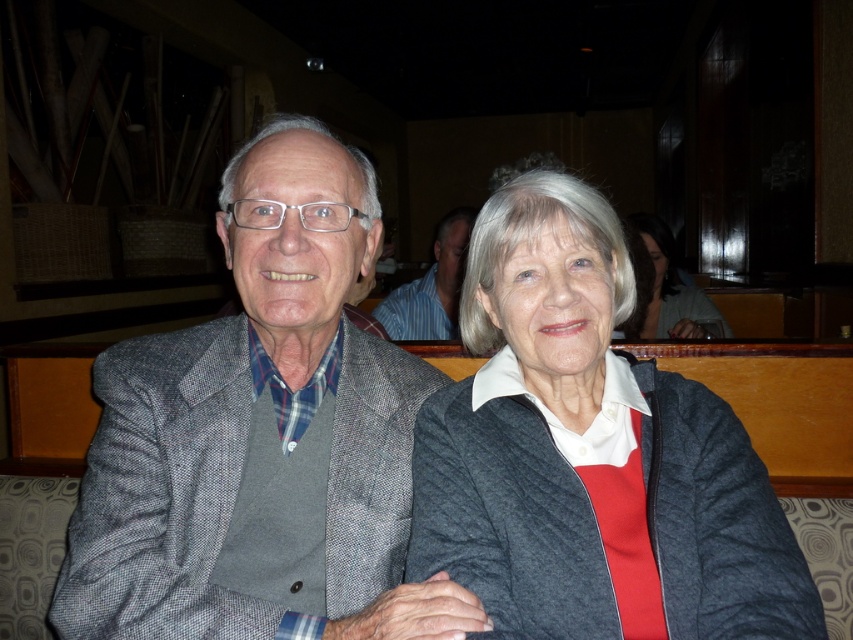
Question: Is matte gray jacket at center wider than striped shirt at center?

Choices:
 (A) no
 (B) yes

Answer: (B)

Question: Which of the following is the farthest from the observer?

Choices:
 (A) (689, 314)
 (B) (204, 509)
 (C) (695, 461)
 (D) (397, 308)

Answer: (A)

Question: Which point appears farthest from the camera in this image?

Choices:
 (A) (183, 429)
 (B) (416, 326)
 (C) (659, 376)

Answer: (B)

Question: Where is matte gray sweater at center located in relation to striped shirt at center in the image?

Choices:
 (A) below
 (B) above

Answer: (B)

Question: Which point is farther to the camera?

Choices:
 (A) (560, 621)
 (B) (418, 330)
 (C) (355, 216)

Answer: (B)

Question: Can you confirm if matte gray jacket at center is positioned to the left of matte gray sweater at center?

Choices:
 (A) no
 (B) yes

Answer: (B)